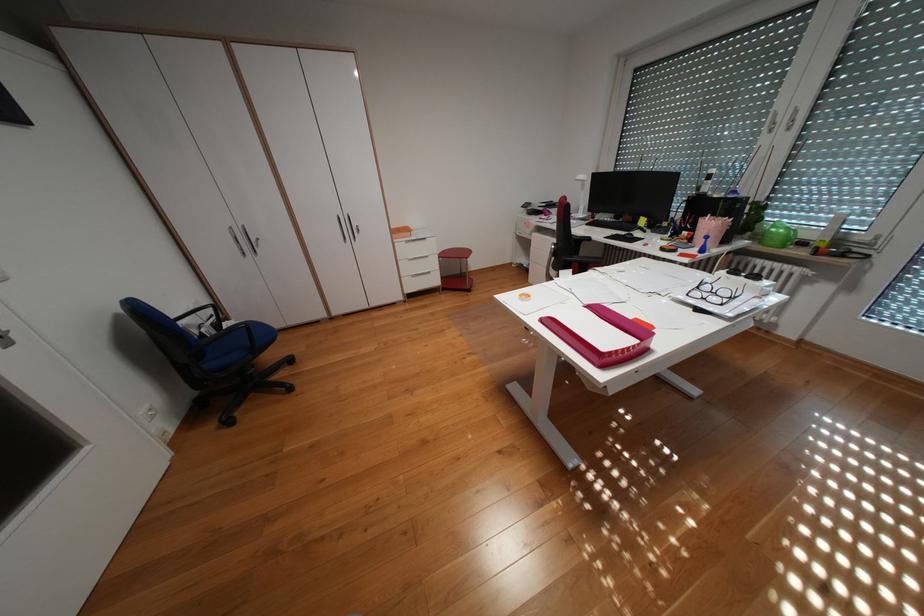
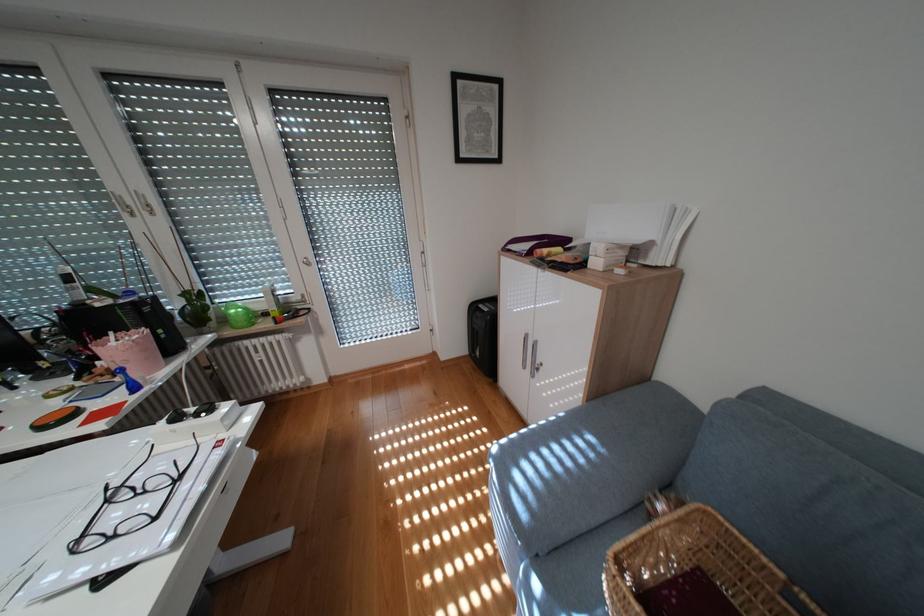
Locate, in the second image, the point that corresponds to pixel 791 119 in the first image.

(141, 201)